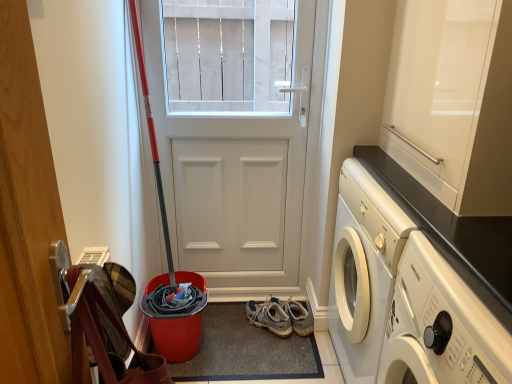
What do you see at coordinates (269, 316) in the screenshot? I see `gray suede sneakers at lower center` at bounding box center [269, 316].

Describe the element at coordinates (452, 233) in the screenshot. The image size is (512, 384). I see `black granite countertop at upper right` at that location.

Find the location of a particular element. gray suede sneakers at lower center is located at coordinates (269, 316).

From a real-world perspective, is black granite countertop at upper right physically below glossy white cabinet at upper right?

Indeed, from a real-world perspective, black granite countertop at upper right is positioned beneath glossy white cabinet at upper right.

Is glossy white cabinet at upper right surrounded by black granite countertop at upper right?

No, glossy white cabinet at upper right is not a part of black granite countertop at upper right.

How different are the orientations of black granite countertop at upper right and glossy white cabinet at upper right in degrees?

black granite countertop at upper right and glossy white cabinet at upper right are facing 0.0602 degrees away from each other.

From the picture: Does black granite countertop at upper right come behind glossy white cabinet at upper right?

Yes, black granite countertop at upper right is further from the viewer.

How many degrees apart are the facing directions of white matte door at center and gray suede sneakers at lower center?

39.5 degrees.

Is white matte door at center next to gray suede sneakers at lower center and touching it?

No, white matte door at center is not in contact with gray suede sneakers at lower center.

Is white matte door at center thinner than gray suede sneakers at lower center?

Yes, white matte door at center is thinner than gray suede sneakers at lower center.

Which is more to the right, white matte door at center or gray suede sneakers at lower center?

From the viewer's perspective, gray suede sneakers at lower center appears more on the right side.

Could you tell me if white glossy washing machine at lower right is turned towards white matte door at center?

No.

Considering the relative positions of white glossy washing machine at lower right and white matte door at center in the image provided, is white glossy washing machine at lower right to the right of white matte door at center from the viewer's perspective?

Yes, white glossy washing machine at lower right is to the right of white matte door at center.

What's the angular difference between white glossy washing machine at lower right and white matte door at center's facing directions?

white glossy washing machine at lower right and white matte door at center are facing 92.9 degrees away from each other.

Is white glossy washing machine at lower right not within white matte door at center?

white glossy washing machine at lower right is positioned outside white matte door at center.

Could you measure the distance between glossy white cabinet at upper right and white glossy washing machine at lower right?

glossy white cabinet at upper right and white glossy washing machine at lower right are 36.68 centimeters apart from each other.

Is glossy white cabinet at upper right facing towards white glossy washing machine at lower right?

No, glossy white cabinet at upper right is not oriented towards white glossy washing machine at lower right.

Relative to white glossy washing machine at lower right, is glossy white cabinet at upper right in front or behind?

glossy white cabinet at upper right is positioned farther from the viewer than white glossy washing machine at lower right.

Which of these two, gray suede sneakers at lower center or white glossy washing machine at lower right, is smaller?

gray suede sneakers at lower center.

Which of these two, gray suede sneakers at lower center or white glossy washing machine at lower right, stands taller?

With more height is white glossy washing machine at lower right.

Is gray suede sneakers at lower center behind white glossy washing machine at lower right?

Yes, it is behind white glossy washing machine at lower right.

From a real-world perspective, is gray suede sneakers at lower center on white glossy washing machine at lower right?

No, from a real-world perspective, gray suede sneakers at lower center is not over white glossy washing machine at lower right

From a real-world perspective, is gray suede sneakers at lower center positioned above or below white matte door at center?

gray suede sneakers at lower center is below white matte door at center.

Is white matte door at center completely or partially inside gray suede sneakers at lower center?

Definitely not — white matte door at center is not inside gray suede sneakers at lower center.

Does point (268, 327) come behind point (198, 82)?

No, (268, 327) is in front of (198, 82).

From the image's perspective, is gray suede sneakers at lower center above white matte door at center?

Incorrect, from the image's perspective, gray suede sneakers at lower center is lower than white matte door at center.

From a real-world perspective, is black granite countertop at upper right below gray suede sneakers at lower center?

Incorrect, from a real-world perspective, black granite countertop at upper right is higher than gray suede sneakers at lower center.

Based on the photo, considering the positions of objects black granite countertop at upper right and gray suede sneakers at lower center in the image provided, who is behind, black granite countertop at upper right or gray suede sneakers at lower center?

gray suede sneakers at lower center is behind.

Is black granite countertop at upper right facing towards gray suede sneakers at lower center?

Yes, black granite countertop at upper right is facing gray suede sneakers at lower center.

Is black granite countertop at upper right inside the boundaries of gray suede sneakers at lower center, or outside?

black granite countertop at upper right is located beyond the bounds of gray suede sneakers at lower center.

Where is `cabinetry located in front of the black granite countertop at upper right`? The image size is (512, 384). cabinetry located in front of the black granite countertop at upper right is located at coordinates (453, 101).

I want to click on footwear below the white matte door at center (from the image's perspective), so click(x=269, y=316).

When comparing their distances from glossy white cabinet at upper right, does white matte door at center or white glossy washing machine at lower right seem further?

Based on the image, white matte door at center appears to be further to glossy white cabinet at upper right.

When comparing their distances from white glossy washing machine at lower right, does white matte door at center or black granite countertop at upper right seem closer?

black granite countertop at upper right is positioned closer to the anchor white glossy washing machine at lower right.

Which object lies nearer to the anchor point white matte door at center, black granite countertop at upper right or white glossy washing machine at lower right?

The object closer to white matte door at center is black granite countertop at upper right.

Looking at the image, which one is located closer to glossy white cabinet at upper right, black granite countertop at upper right or gray suede sneakers at lower center?

black granite countertop at upper right lies closer to glossy white cabinet at upper right than the other object.

Based on their spatial positions, is glossy white cabinet at upper right or gray suede sneakers at lower center closer to white glossy washing machine at lower right?

glossy white cabinet at upper right is positioned closer to the anchor white glossy washing machine at lower right.

Looking at the image, which one is located further to glossy white cabinet at upper right, white matte door at center or gray suede sneakers at lower center?

gray suede sneakers at lower center lies further to glossy white cabinet at upper right than the other object.

Estimate the real-world distances between objects in this image. Which object is further from white glossy washing machine at lower right, glossy white cabinet at upper right or white matte door at center?

white matte door at center is further to white glossy washing machine at lower right.

Looking at the image, which one is located closer to white matte door at center, gray suede sneakers at lower center or white glossy washing machine at lower right?

gray suede sneakers at lower center.

Identify the location of counter top between white glossy washing machine at lower right and white matte door at center in the front-back direction. (452, 233).

Image resolution: width=512 pixels, height=384 pixels. What are the coordinates of `counter top between glossy white cabinet at upper right and white glossy washing machine at lower right in the up-down direction` in the screenshot? It's located at (452, 233).

Where is `counter top between glossy white cabinet at upper right and gray suede sneakers at lower center in the front-back direction`? This screenshot has height=384, width=512. counter top between glossy white cabinet at upper right and gray suede sneakers at lower center in the front-back direction is located at coordinates (452, 233).

In order to click on door located between white glossy washing machine at lower right and gray suede sneakers at lower center in the depth direction in this screenshot , I will do `click(232, 136)`.